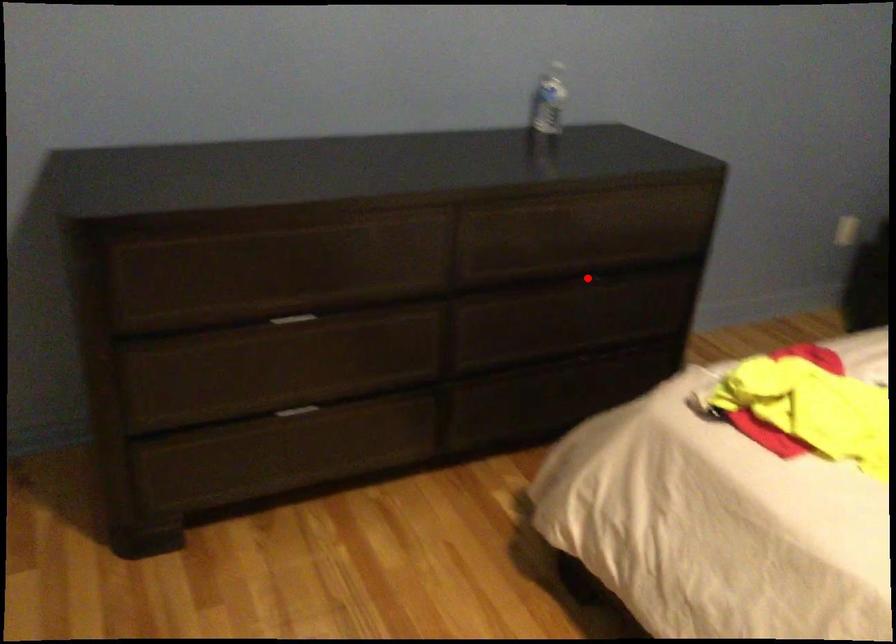
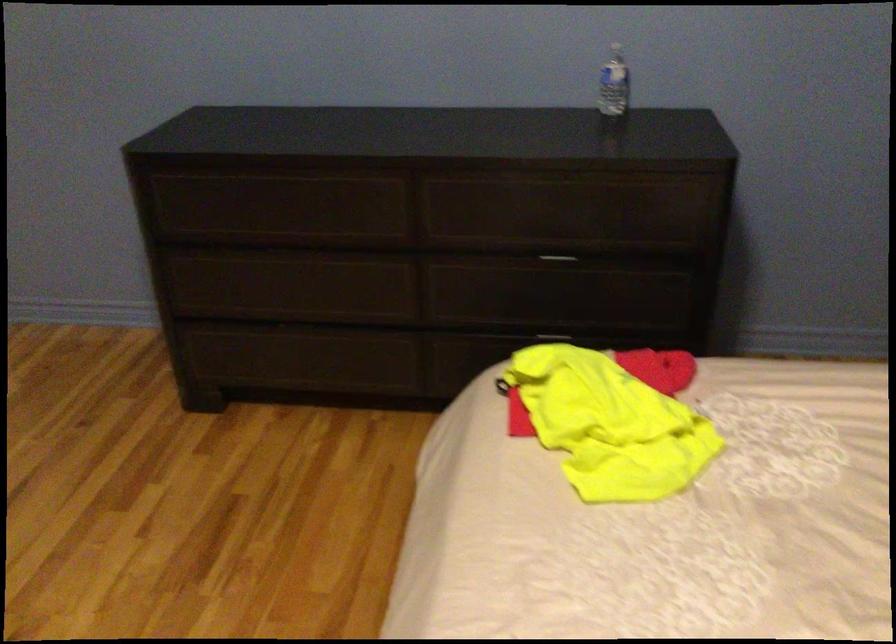
In the second image, find the point that corresponds to the highlighted location in the first image.

(557, 260)